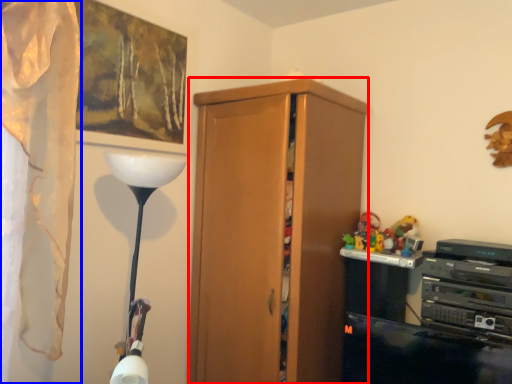
Question: Which object appears closest to the camera in this image, cabinetry (highlighted by a red box) or curtain (highlighted by a blue box)?

Choices:
 (A) cabinetry
 (B) curtain

Answer: (B)